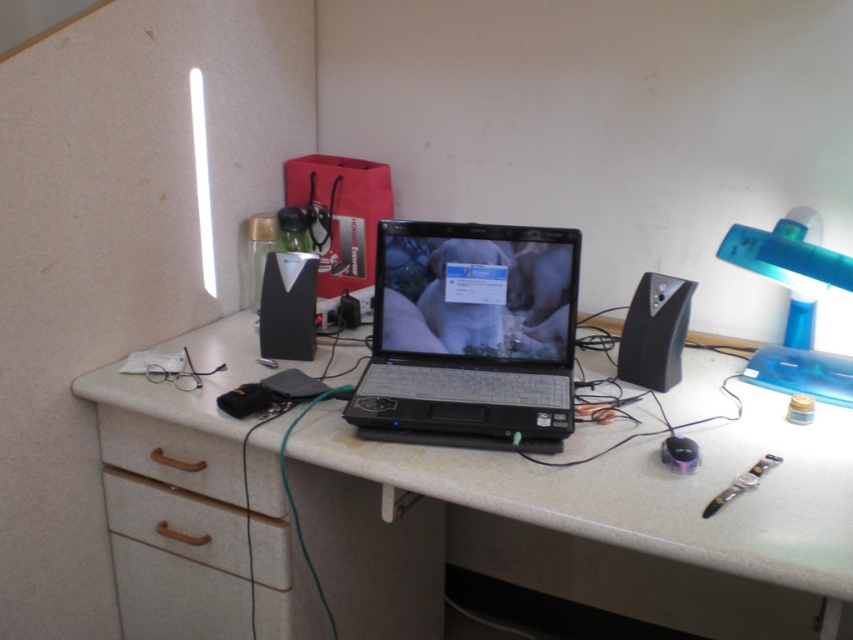
Can you confirm if white laminate table at center is wider than wooden drawer at lower left?

Yes.

Does white laminate table at center lie behind wooden drawer at lower left?

No, it is not.

Image resolution: width=853 pixels, height=640 pixels. I want to click on white laminate table at center, so click(x=651, y=492).

Is white laminate table at center further to the viewer compared to brown wood drawer at lower left?

No.

Does white laminate table at center have a smaller size compared to brown wood drawer at lower left?

No.

Does point (107, 392) lie behind point (212, 452)?

Yes, point (107, 392) is behind point (212, 452).

This screenshot has height=640, width=853. I want to click on white laminate table at center, so click(x=651, y=492).

Is white laminate table at center in front of blue translucent lamp at right?

Yes, it is.

Does white laminate table at center have a smaller size compared to blue translucent lamp at right?

No, white laminate table at center is not smaller than blue translucent lamp at right.

Find the location of a particular element. The image size is (853, 640). white laminate table at center is located at coordinates (651, 492).